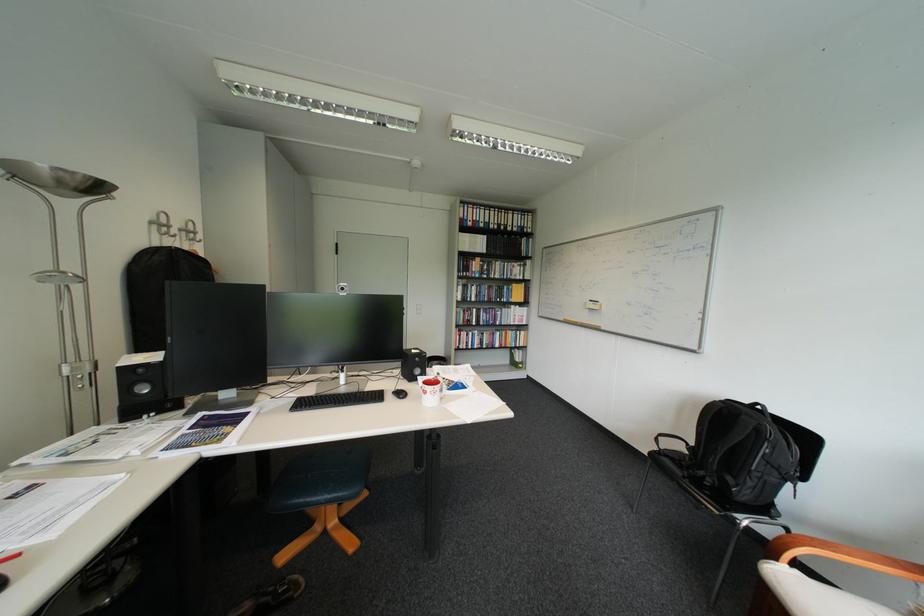
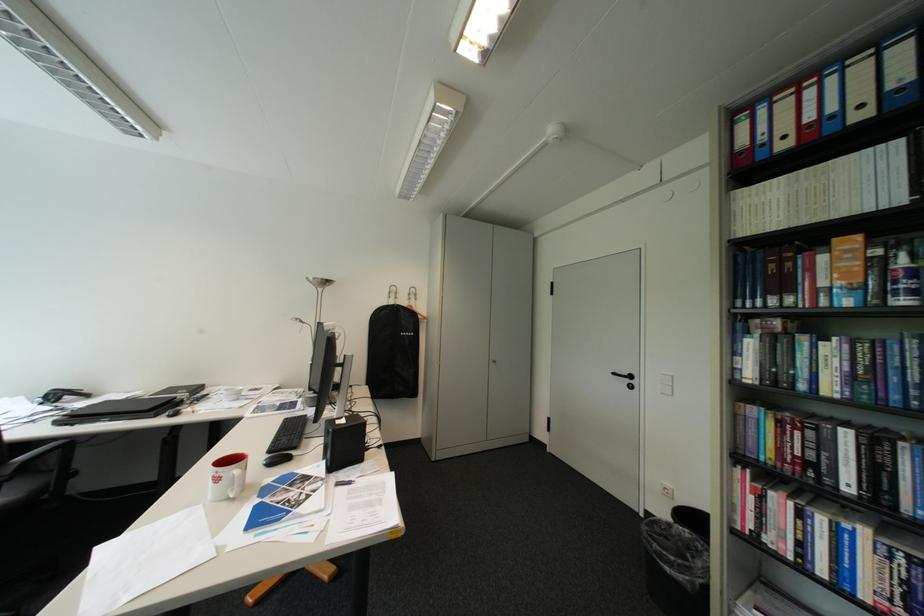
In the second image, find the point that corresponds to [482,222] in the first image.

(796, 138)